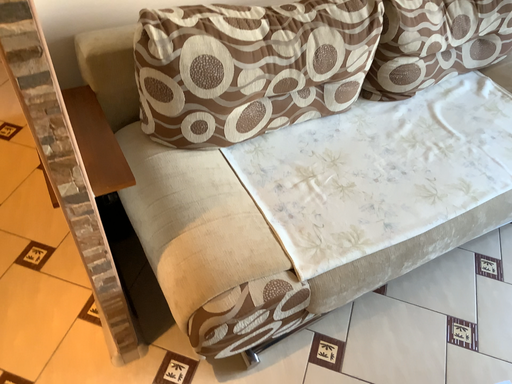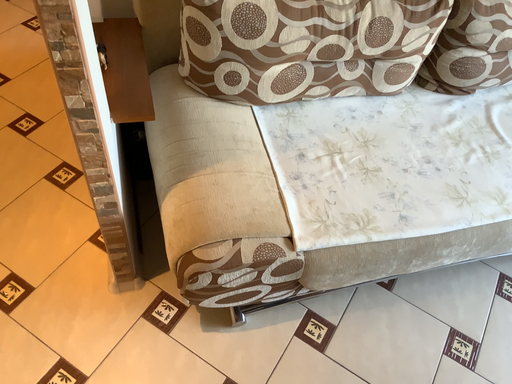
Question: How did the camera likely rotate when shooting the video?

Choices:
 (A) rotated left
 (B) rotated right

Answer: (A)